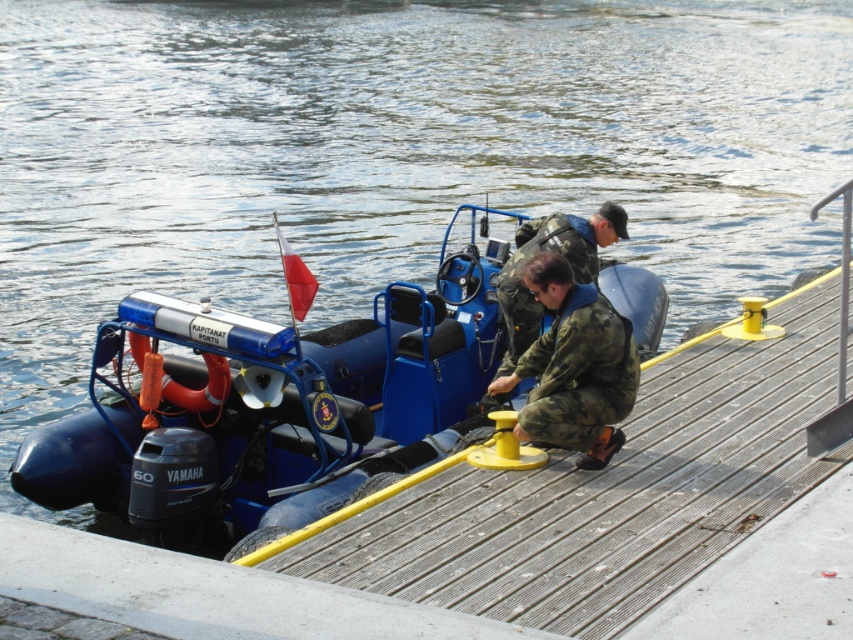
Is blue rubber boat at center to the right of camo fabric uniform at center from the viewer's perspective?

In fact, blue rubber boat at center is to the left of camo fabric uniform at center.

Between point (521, 237) and point (608, 452), which one is positioned in front?

Positioned in front is point (608, 452).

Where is `blue rubber boat at center`? blue rubber boat at center is located at coordinates coord(283,401).